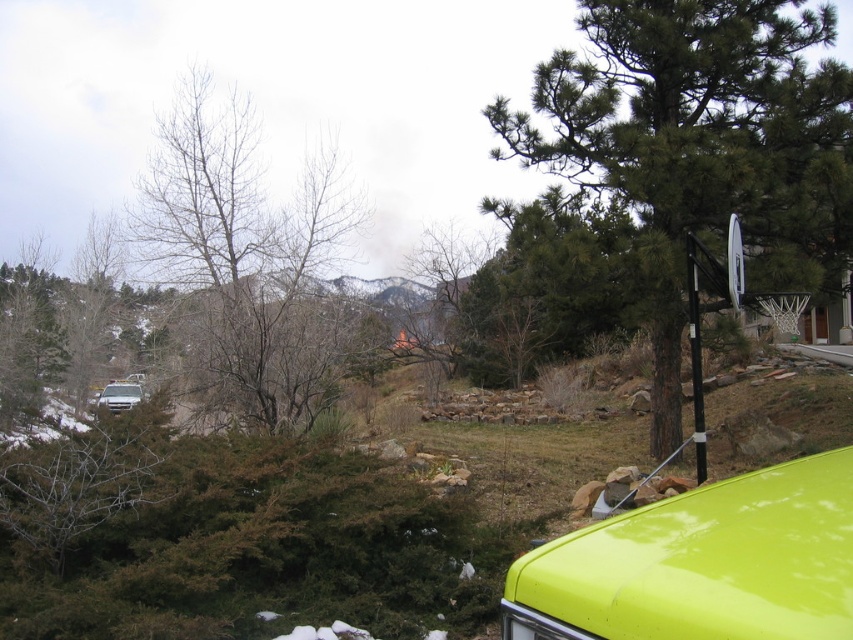
Does lime green plastic truck at lower right appear on the right side of bare branches at left?

Yes, lime green plastic truck at lower right is to the right of bare branches at left.

Which is in front, point (793, 516) or point (268, 362)?

Point (793, 516) is in front.

Locate an element on the screen. lime green plastic truck at lower right is located at coordinates (701, 564).

Image resolution: width=853 pixels, height=640 pixels. What do you see at coordinates (699, 147) in the screenshot? I see `green leafy tree at center-right` at bounding box center [699, 147].

Between green leafy tree at center-right and bare branches at left, which one has less height?

Standing shorter between the two is green leafy tree at center-right.

Is point (564, 74) less distant than point (183, 112)?

Yes, it is in front of point (183, 112).

In order to click on green leafy tree at center-right in this screenshot , I will do `click(699, 147)`.

Which is behind, point (833, 580) or point (106, 408)?

Positioned behind is point (106, 408).

Who is positioned more to the left, lime green plastic truck at lower right or matte silver suv at left?

From the viewer's perspective, matte silver suv at left appears more on the left side.

Describe the element at coordinates (701, 564) in the screenshot. The width and height of the screenshot is (853, 640). I see `lime green plastic truck at lower right` at that location.

At what (x,y) coordinates should I click in order to perform the action: click on lime green plastic truck at lower right. Please return your answer as a coordinate pair (x, y). Looking at the image, I should click on (701, 564).